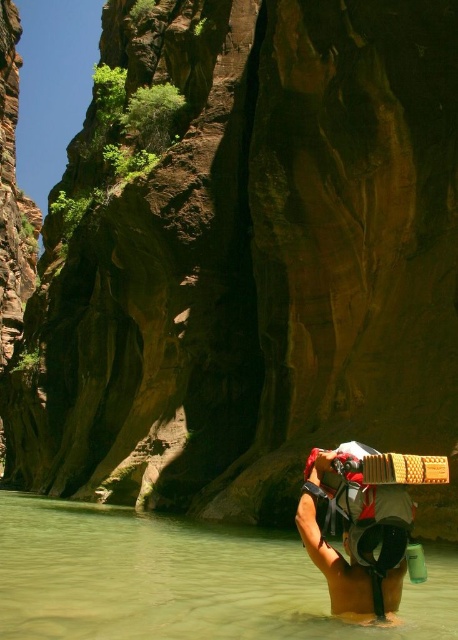
Does point (87, 593) come behind point (341, 593)?

Yes.

Which is more to the right, clear water at center or white fabric backpack at lower center?

white fabric backpack at lower center is more to the right.

In order to click on clear water at center in this screenshot , I will do `click(179, 580)`.